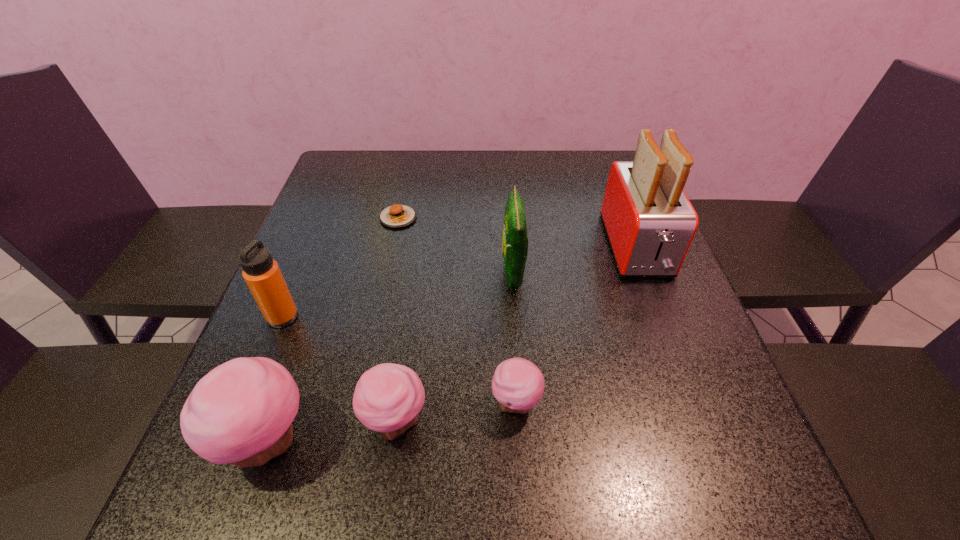
Find the location of a particular element. the tallest cupcake is located at coordinates (241, 412).

Image resolution: width=960 pixels, height=540 pixels. Identify the location of the second shortest cupcake. (387, 399).

At what (x,y) coordinates should I click in order to perform the action: click on the fifth tallest object. Please return your answer as a coordinate pair (x, y). Looking at the image, I should click on (387, 399).

At what (x,y) coordinates should I click in order to perform the action: click on the sixth tallest object. Please return your answer as a coordinate pair (x, y). The width and height of the screenshot is (960, 540). Looking at the image, I should click on (518, 385).

Locate an element on the screen. Image resolution: width=960 pixels, height=540 pixels. the shortest cupcake is located at coordinates (518, 385).

Identify the location of food. (396, 216).

Where is `crisp (potato chip)`? The height and width of the screenshot is (540, 960). crisp (potato chip) is located at coordinates (515, 238).

Locate an element on the screen. This screenshot has height=540, width=960. toaster is located at coordinates (650, 223).

The height and width of the screenshot is (540, 960). What are the coordinates of `the rightmost object` in the screenshot? It's located at pos(650,223).

You are a GUI agent. You are given a task and a screenshot of the screen. Output one action in this format:
    pyautogui.click(x=<x>, y=<y>)
    Task: Click on the fourth nearest object
    The image size is (960, 540).
    Given the screenshot: What is the action you would take?
    pyautogui.click(x=261, y=272)